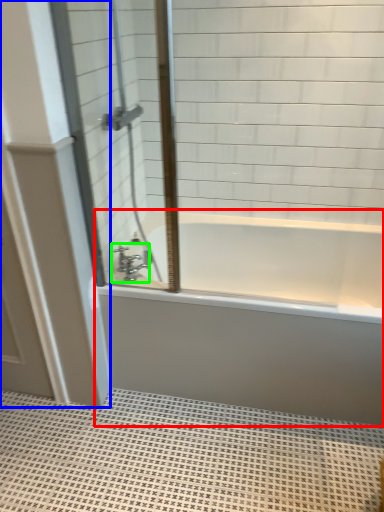
Question: Estimate the real-world distances between objects in this image. Which object is closer to bathtub (highlighted by a red box), door (highlighted by a blue box) or tap (highlighted by a green box)?

Choices:
 (A) door
 (B) tap

Answer: (A)